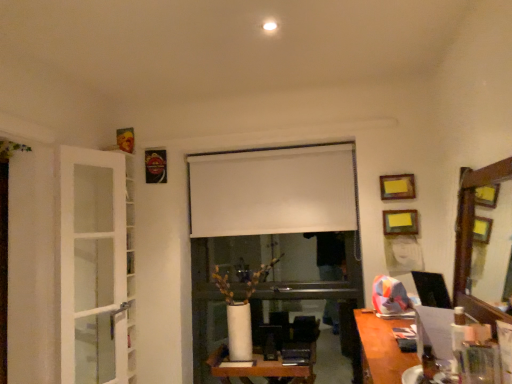
Question: Does wooden picture frame at upper right, which ranks as the second picture frame in front-to-back order, have a greater width compared to metallic gold picture frame at upper left, placed as the first picture frame when sorted from top to bottom?

Choices:
 (A) no
 (B) yes

Answer: (A)

Question: From a real-world perspective, is wooden picture frame at upper right, which is the 2th picture frame from back to front, under metallic gold picture frame at upper left, acting as the first picture frame starting from the left?

Choices:
 (A) yes
 (B) no

Answer: (A)

Question: From the image's perspective, would you say wooden picture frame at upper right, which is the 2th picture frame from back to front, is shown under metallic gold picture frame at upper left, placed as the first picture frame when sorted from top to bottom?

Choices:
 (A) yes
 (B) no

Answer: (A)

Question: Is wooden picture frame at upper right, which ranks as the second picture frame in left-to-right order, taller than metallic gold picture frame at upper left, the third picture frame from the bottom?

Choices:
 (A) yes
 (B) no

Answer: (B)

Question: Is wooden picture frame at upper right, which ranks as the second picture frame in front-to-back order, far from metallic gold picture frame at upper left, the third picture frame from the right?

Choices:
 (A) yes
 (B) no

Answer: (A)

Question: Considering the relative sizes of wooden picture frame at upper right, the 2th picture frame when ordered from right to left, and metallic gold picture frame at upper left, the first picture frame in the back-to-front sequence, in the image provided, is wooden picture frame at upper right, the 2th picture frame when ordered from right to left, thinner than metallic gold picture frame at upper left, the first picture frame in the back-to-front sequence,?

Choices:
 (A) no
 (B) yes

Answer: (B)

Question: From a real-world perspective, is wooden picture frame at upper right, the 2th picture frame in the bottom-to-top sequence, located beneath white matte window screen at center?

Choices:
 (A) no
 (B) yes

Answer: (B)

Question: Is white matte window screen at center inside wooden picture frame at upper right, the 2th picture frame in the bottom-to-top sequence?

Choices:
 (A) no
 (B) yes

Answer: (A)

Question: Can you confirm if wooden picture frame at upper right, which ranks as the second picture frame in left-to-right order, is shorter than white matte window screen at center?

Choices:
 (A) yes
 (B) no

Answer: (A)

Question: Is wooden picture frame at upper right, the 2th picture frame when ordered from right to left, outside of white matte window screen at center?

Choices:
 (A) no
 (B) yes

Answer: (B)

Question: Does wooden picture frame at upper right, the 2th picture frame when ordered from right to left, have a greater width compared to white matte window screen at center?

Choices:
 (A) no
 (B) yes

Answer: (A)

Question: Considering the relative sizes of wooden picture frame at upper right, which ranks as the second picture frame in front-to-back order, and white matte window screen at center in the image provided, is wooden picture frame at upper right, which ranks as the second picture frame in front-to-back order, bigger than white matte window screen at center?

Choices:
 (A) no
 (B) yes

Answer: (A)

Question: Is white matte window screen at center touching wooden framed mirror at right?

Choices:
 (A) yes
 (B) no

Answer: (B)